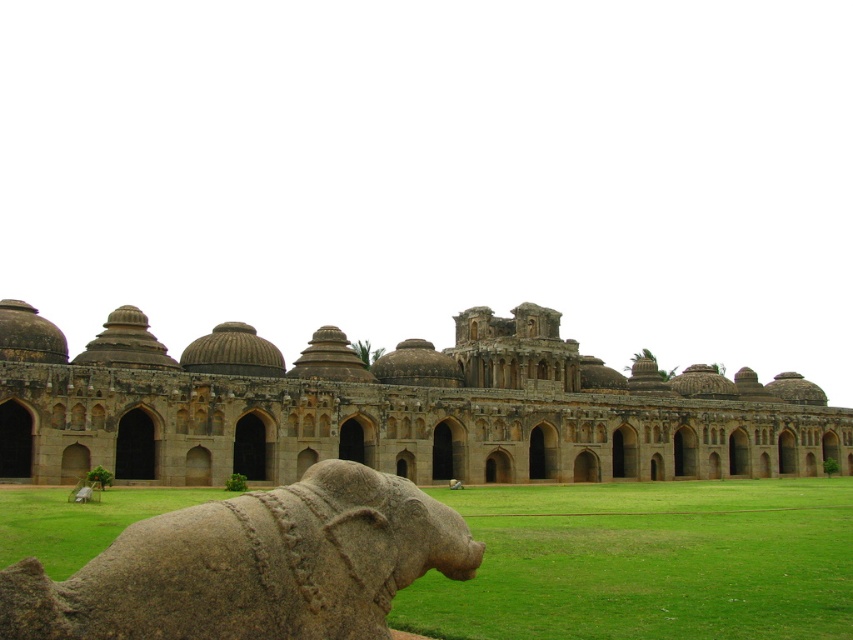
You are standing at the entrance of the grand architectural structure and want to take a photo of the point at coordinates point [721,428]. Your camera can focus on objects up to 400 feet away. Will the point be in focus?

The distance of point [721,428] from the camera is 402.15 feet, which is slightly beyond the camera focus range of 400 feet. Therefore, the point will not be in focus.

You are standing in front of the brown stone palace at center and the gray stone elephant at lower left. Which object is positioned higher relative to the other?

The brown stone palace at center is positioned higher than the gray stone elephant at lower left.

You are standing at the entrance of the grand building and see two points marked on the facade. The first point is at coordinates point (117, 406) and the second is at point (360, 564). Which point is closer to you?

Point (360, 564) is closer to you because point (117, 406) is behind it.